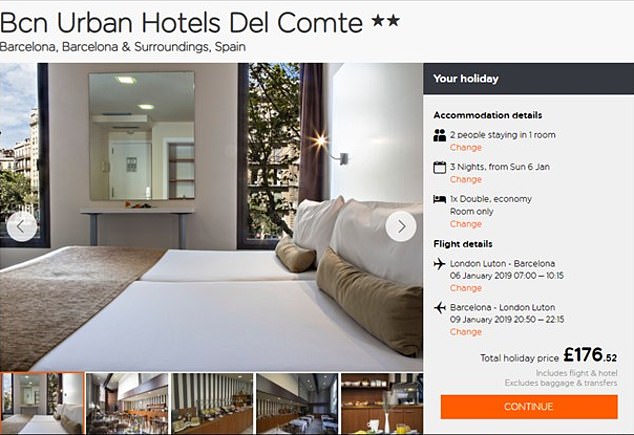
Locate an element on the screen. The image size is (634, 435). crisp white bedsheet is located at coordinates (188, 324), (198, 267).